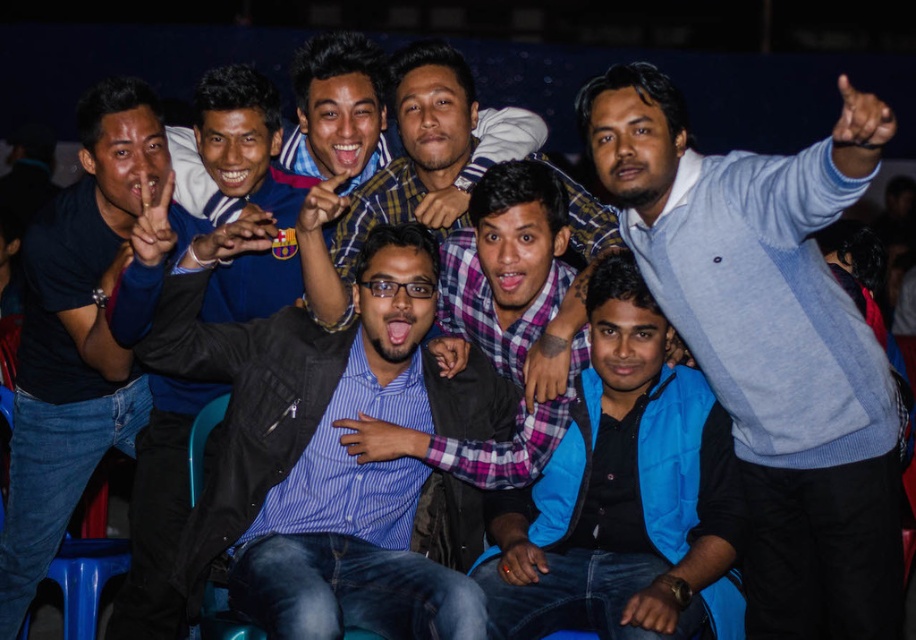
You are a photographer trying to adjust the lighting for a group photo. You need to place a spotlight at the center of the group. Based on the image, where should you position the spotlight relative to the blue striped shirt at center?

The blue striped shirt at center is already positioned at the center of the group, so the spotlight should be placed directly at the location of the blue striped shirt at center.